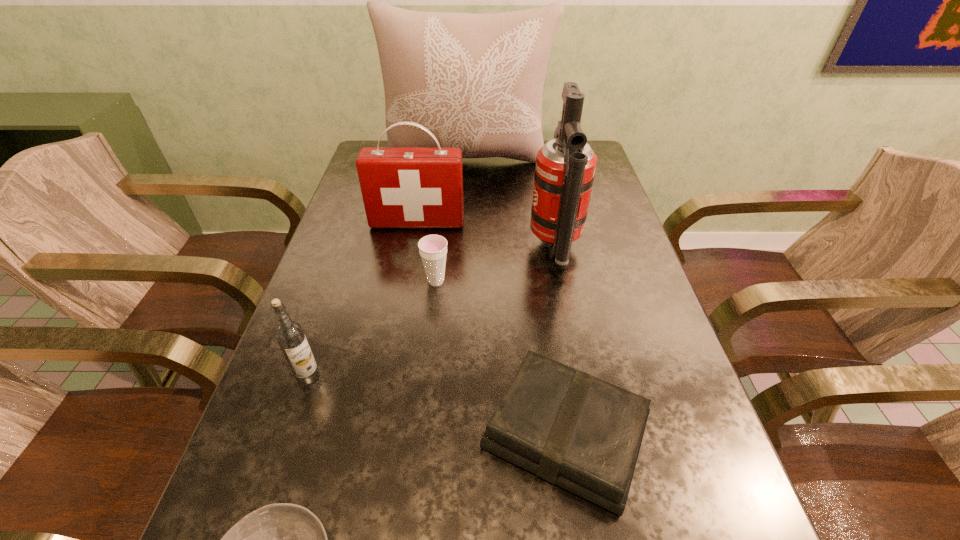
The image size is (960, 540). Identify the location of vacant space located on the front label side of the fire extinguisher. (x=510, y=248).

Locate an element on the screen. Image resolution: width=960 pixels, height=540 pixels. vacant space located on the front face of the first-aid kit is located at coordinates (395, 350).

Find the location of `vacant space located on the label of the vodka`. vacant space located on the label of the vodka is located at coordinates (270, 490).

The height and width of the screenshot is (540, 960). Find the location of `free space located 0.260m on the front of the third shortest object`. free space located 0.260m on the front of the third shortest object is located at coordinates (424, 388).

This screenshot has width=960, height=540. What are the coordinates of `vacant area located on the back of the book` in the screenshot? It's located at (539, 253).

Image resolution: width=960 pixels, height=540 pixels. Identify the location of object present at the far edge. (475, 81).

This screenshot has width=960, height=540. Find the location of `cushion located in the left edge section of the desktop`. cushion located in the left edge section of the desktop is located at coordinates (475, 81).

You are a GUI agent. You are given a task and a screenshot of the screen. Output one action in this format:
    pyautogui.click(x=<x>, y=<y>)
    Task: Click on the first-aid kit that is at the left edge
    
    Given the screenshot: What is the action you would take?
    pyautogui.click(x=402, y=187)

This screenshot has height=540, width=960. In order to click on vodka at the left edge in this screenshot , I will do `click(289, 334)`.

Identify the location of fire extinguisher located in the right edge section of the desktop. tap(565, 168).